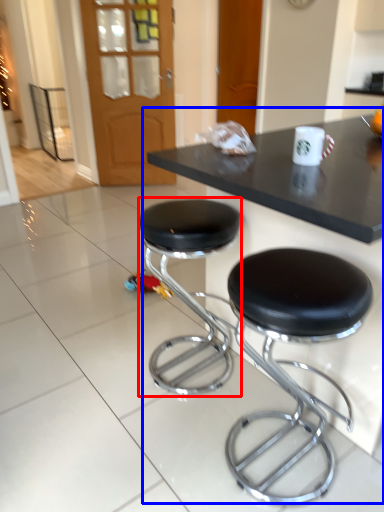
Question: Which object is closer to the camera taking this photo, stool (highlighted by a red box) or table (highlighted by a blue box)?

Choices:
 (A) stool
 (B) table

Answer: (B)